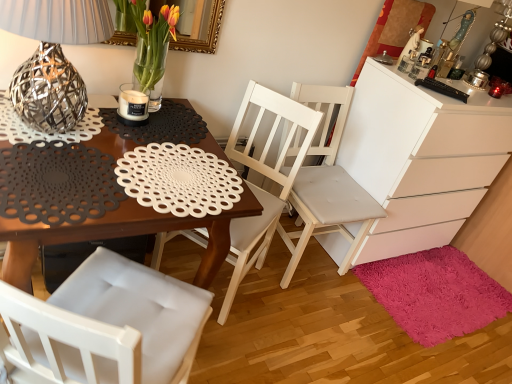
Where is `free space in front of matte glass vase with tulips at upper center`? This screenshot has height=384, width=512. free space in front of matte glass vase with tulips at upper center is located at coordinates coord(142,126).